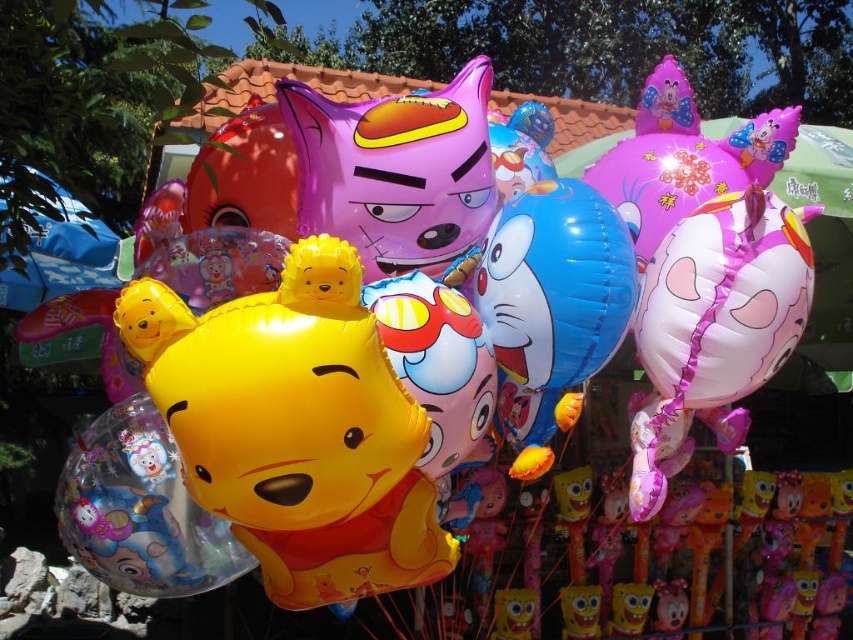
In the scene with the purple glossy balloon at center and the pink glossy pig at upper right, which object is positioned to the right side?

The pink glossy pig at upper right is positioned to the right of the purple glossy balloon at center.

You are a child trying to grab the purple glossy balloon at center and the pink glossy pig at upper right. Which one can you reach first without moving your position?

The purple glossy balloon at center is closer to the viewer than the pink glossy pig at upper right, so you can reach the purple glossy balloon at center first.

You are a party planner arranging balloons for a child. You have a helium tank that can lift a maximum of 10 balloons. The yellow matte winnie the pooh balloon at center is larger and heavier than the pink glossy pig at upper right. If you want to ensure the balloons float evenly, which balloon should you prioritize placing first?

The yellow matte winnie the pooh balloon at center should be prioritized because it is larger and heavier than the pink glossy pig at upper right, so placing it first ensures the helium can adequately support its weight for even floating.